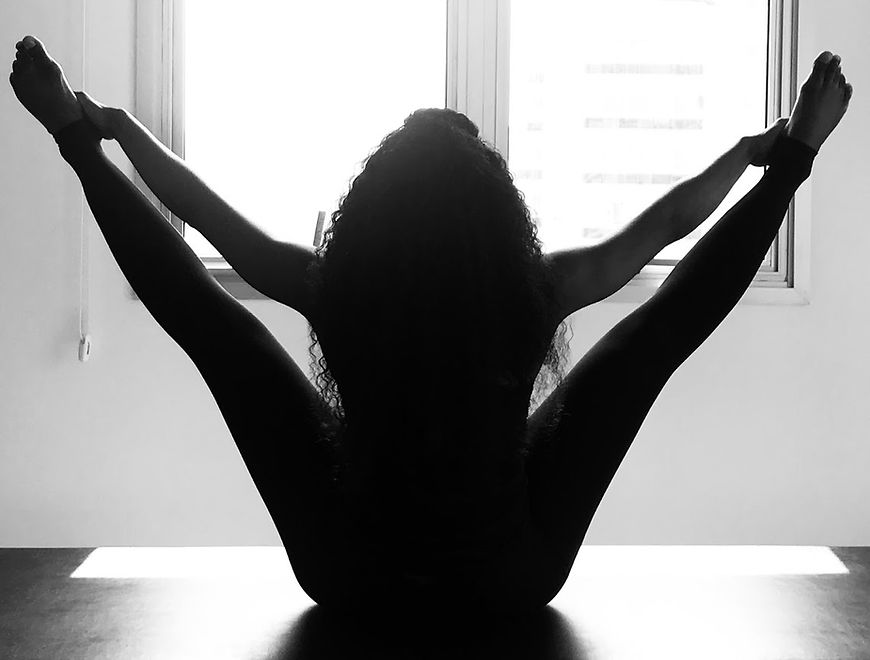
The image size is (870, 660). In order to click on floor in this screenshot , I will do `click(724, 634)`.